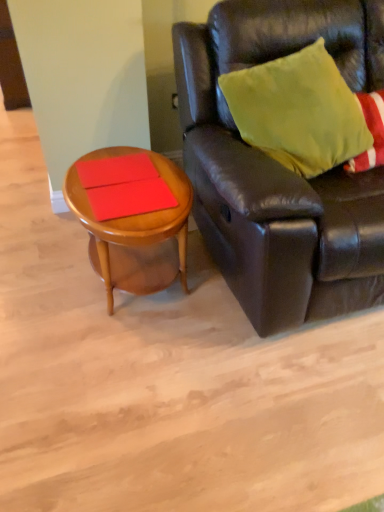
Question: Can you confirm if matte red book at left, the first plank viewed from the top, is positioned to the left of leather couch at right?

Choices:
 (A) no
 (B) yes

Answer: (B)

Question: Considering the relative sizes of matte red book at left, the first plank viewed from the top, and leather couch at right in the image provided, is matte red book at left, the first plank viewed from the top, smaller than leather couch at right?

Choices:
 (A) no
 (B) yes

Answer: (B)

Question: Considering the relative positions of matte red book at left, the first plank viewed from the top, and leather couch at right in the image provided, is matte red book at left, the first plank viewed from the top, behind leather couch at right?

Choices:
 (A) yes
 (B) no

Answer: (A)

Question: Can you see matte red book at left, positioned as the second plank in bottom-to-top order, touching leather couch at right?

Choices:
 (A) yes
 (B) no

Answer: (B)

Question: Is matte red book at left, positioned as the second plank in bottom-to-top order, facing away from leather couch at right?

Choices:
 (A) yes
 (B) no

Answer: (A)

Question: Considering the relative sizes of matte red book at left, positioned as the second plank in bottom-to-top order, and leather couch at right in the image provided, is matte red book at left, positioned as the second plank in bottom-to-top order, wider than leather couch at right?

Choices:
 (A) yes
 (B) no

Answer: (B)

Question: From the image's perspective, is matte red book at left, positioned as the second plank in bottom-to-top order, below matte red book at center, positioned as the 1th plank in bottom-to-top order?

Choices:
 (A) yes
 (B) no

Answer: (B)

Question: Considering the relative positions of matte red book at left, positioned as the second plank in bottom-to-top order, and matte red book at center, positioned as the 1th plank in bottom-to-top order, in the image provided, is matte red book at left, positioned as the second plank in bottom-to-top order, in front of matte red book at center, positioned as the 1th plank in bottom-to-top order,?

Choices:
 (A) no
 (B) yes

Answer: (A)

Question: From the image's perspective, is matte red book at left, positioned as the second plank in bottom-to-top order, on matte red book at center, positioned as the second plank in top-to-bottom order?

Choices:
 (A) no
 (B) yes

Answer: (B)

Question: Are matte red book at left, positioned as the second plank in bottom-to-top order, and matte red book at center, positioned as the second plank in top-to-bottom order, beside each other?

Choices:
 (A) yes
 (B) no

Answer: (B)

Question: From a real-world perspective, is matte red book at left, positioned as the second plank in bottom-to-top order, located beneath matte red book at center, positioned as the 1th plank in bottom-to-top order?

Choices:
 (A) yes
 (B) no

Answer: (A)

Question: Is matte red book at left, the first plank viewed from the top, smaller than matte red book at center, positioned as the 1th plank in bottom-to-top order?

Choices:
 (A) yes
 (B) no

Answer: (A)

Question: Does matte red book at center, positioned as the 1th plank in bottom-to-top order, have a lesser width compared to matte red book at left, positioned as the second plank in bottom-to-top order?

Choices:
 (A) yes
 (B) no

Answer: (B)